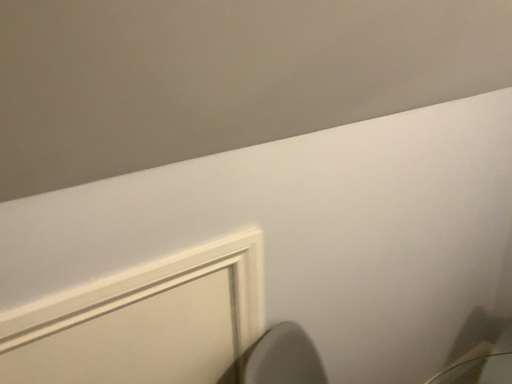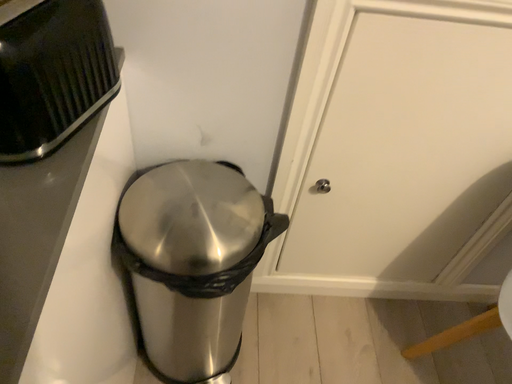
Question: Which way did the camera rotate in the video?

Choices:
 (A) rotated right
 (B) rotated left

Answer: (B)